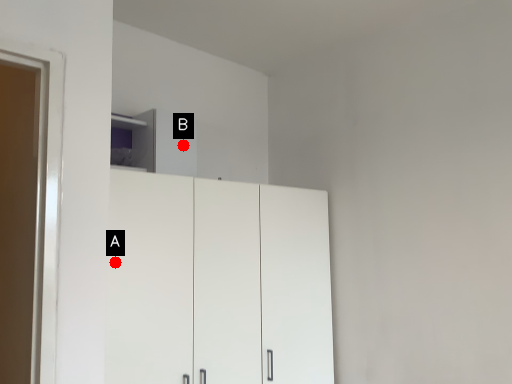
Question: Two points are circled on the image, labeled by A and B beside each circle. Which point is farther from the camera taking this photo?

Choices:
 (A) A is further
 (B) B is further

Answer: (B)